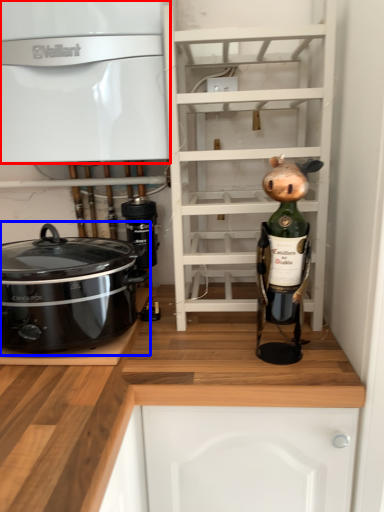
Question: Which object is closer to the camera taking this photo, cabinetry (highlighted by a red box) or home appliance (highlighted by a blue box)?

Choices:
 (A) cabinetry
 (B) home appliance

Answer: (B)